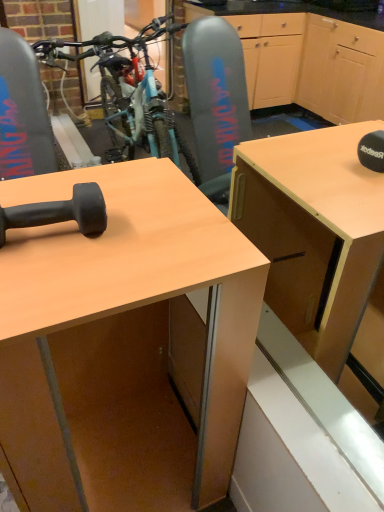
Question: Considering the relative positions of black rubber dumbbell at lower left and matte wood desk at center in the image provided, is black rubber dumbbell at lower left behind matte wood desk at center?

Choices:
 (A) yes
 (B) no

Answer: (A)

Question: Can you confirm if black rubber dumbbell at lower left is taller than matte wood desk at center?

Choices:
 (A) no
 (B) yes

Answer: (A)

Question: Is matte wood desk at center a part of black rubber dumbbell at lower left?

Choices:
 (A) yes
 (B) no

Answer: (B)

Question: Is black rubber dumbbell at lower left at the left side of matte wood desk at center?

Choices:
 (A) yes
 (B) no

Answer: (A)

Question: Is black rubber dumbbell at lower left positioned before matte wood desk at center?

Choices:
 (A) no
 (B) yes

Answer: (A)

Question: Considering the relative sizes of black rubber dumbbell at lower left and matte wood desk at center in the image provided, is black rubber dumbbell at lower left wider than matte wood desk at center?

Choices:
 (A) no
 (B) yes

Answer: (A)

Question: Does matte wood desk at center appear on the right side of black rubber dumbbell at lower left?

Choices:
 (A) no
 (B) yes

Answer: (B)

Question: Considering the relative sizes of matte wood desk at center and black rubber dumbbell at lower left in the image provided, is matte wood desk at center thinner than black rubber dumbbell at lower left?

Choices:
 (A) no
 (B) yes

Answer: (A)

Question: From the image's perspective, is matte wood desk at center under black rubber dumbbell at lower left?

Choices:
 (A) no
 (B) yes

Answer: (B)

Question: From a real-world perspective, is matte wood desk at center on black rubber dumbbell at lower left?

Choices:
 (A) yes
 (B) no

Answer: (B)

Question: From a real-world perspective, does matte wood desk at center sit lower than black rubber dumbbell at lower left?

Choices:
 (A) no
 (B) yes

Answer: (B)

Question: Does matte wood desk at center have a greater height compared to black rubber dumbbell at lower left?

Choices:
 (A) no
 (B) yes

Answer: (B)

Question: Based on their sizes in the image, would you say matte wood desk at center is bigger or smaller than black rubber dumbbell at lower left?

Choices:
 (A) big
 (B) small

Answer: (A)